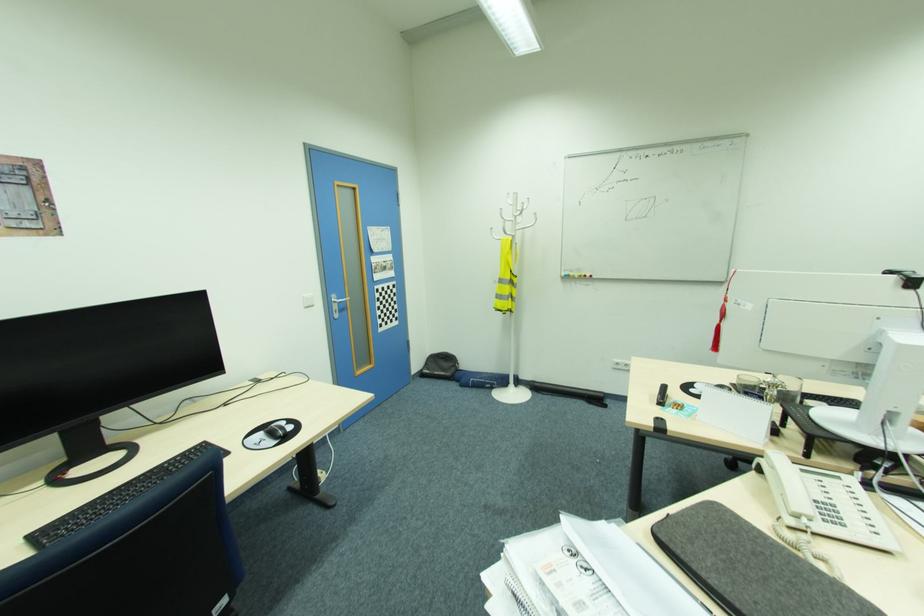
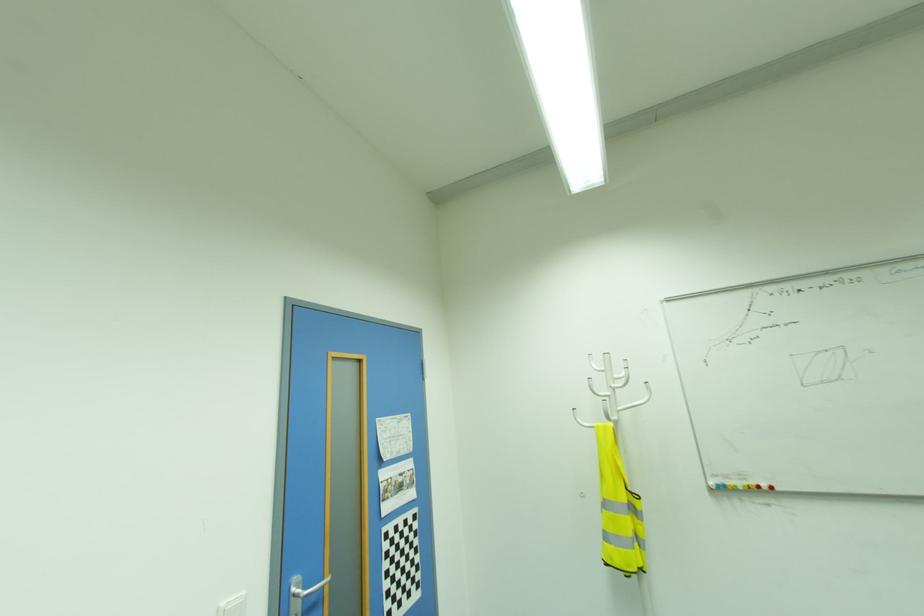
Where in the second image is the point corresponding to [335,300] from the first image?

(296, 590)